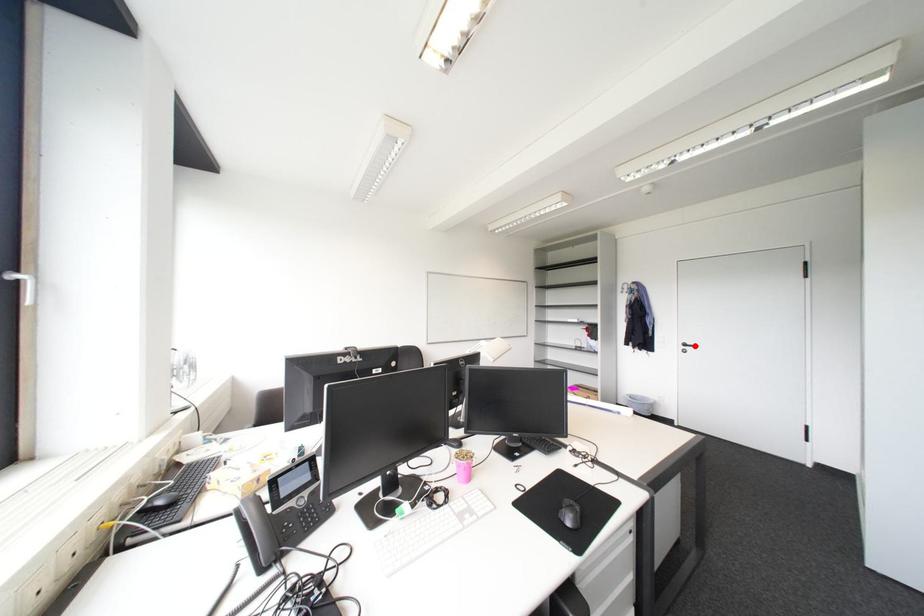
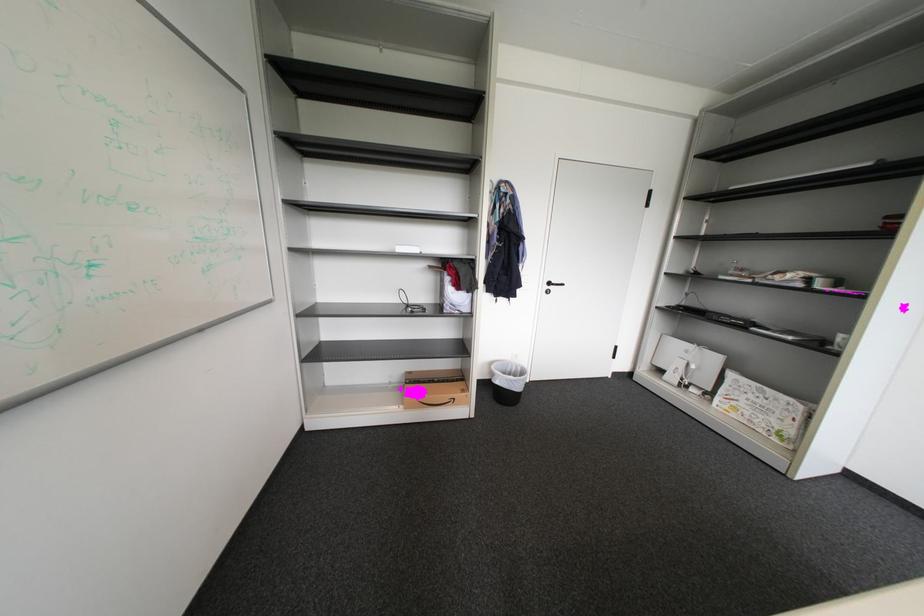
Where in the second image is the point corresponding to the highlighted location from the first image?

(560, 285)